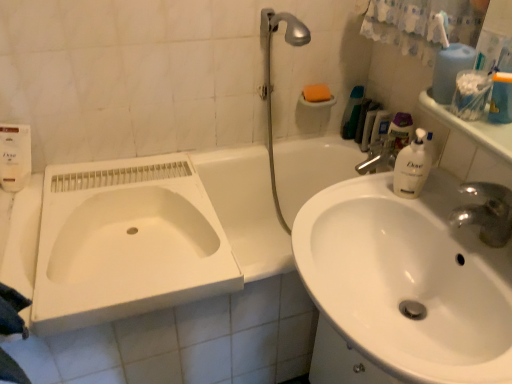
Question: Considering the relative positions of clear plastic container at upper right, which is the second mouthwash in back-to-front order, and silver metallic shower head at upper right in the image provided, is clear plastic container at upper right, which is the second mouthwash in back-to-front order, to the right of silver metallic shower head at upper right from the viewer's perspective?

Choices:
 (A) no
 (B) yes

Answer: (B)

Question: From a real-world perspective, is clear plastic container at upper right, the first mouthwash when ordered from left to right, positioned under silver metallic shower head at upper right based on gravity?

Choices:
 (A) no
 (B) yes

Answer: (A)

Question: Is clear plastic container at upper right, arranged as the 1th mouthwash when viewed from the front, touching silver metallic shower head at upper right?

Choices:
 (A) no
 (B) yes

Answer: (A)

Question: Is clear plastic container at upper right, the first mouthwash when ordered from left to right, wider than silver metallic shower head at upper right?

Choices:
 (A) no
 (B) yes

Answer: (A)

Question: Would you say silver metallic shower head at upper right is part of clear plastic container at upper right, the first mouthwash when ordered from left to right,'s contents?

Choices:
 (A) yes
 (B) no

Answer: (B)

Question: From a real-world perspective, is orange matte soap at upper center above or below silver metallic shower head at upper right?

Choices:
 (A) above
 (B) below

Answer: (A)

Question: From their relative heights in the image, would you say orange matte soap at upper center is taller or shorter than silver metallic shower head at upper right?

Choices:
 (A) tall
 (B) short

Answer: (B)

Question: Considering the positions of orange matte soap at upper center and silver metallic shower head at upper right in the image, is orange matte soap at upper center bigger or smaller than silver metallic shower head at upper right?

Choices:
 (A) small
 (B) big

Answer: (A)

Question: Visually, is orange matte soap at upper center positioned to the left or to the right of silver metallic shower head at upper right?

Choices:
 (A) left
 (B) right

Answer: (B)

Question: From a real-world perspective, is green matte toothpaste tube at upper right, the 2th toiletry from the right, above or below clear plastic bottle at upper right, the second mouthwash viewed from the left?

Choices:
 (A) below
 (B) above

Answer: (B)

Question: Is green matte toothpaste tube at upper right, which appears as the first toiletry when viewed from the left, bigger or smaller than clear plastic bottle at upper right, the 2th mouthwash viewed from the front?

Choices:
 (A) big
 (B) small

Answer: (B)

Question: Is green matte toothpaste tube at upper right, which appears as the first toiletry when viewed from the left, to the left or to the right of clear plastic bottle at upper right, the 2th mouthwash viewed from the front, in the image?

Choices:
 (A) left
 (B) right

Answer: (A)

Question: Do you think green matte toothpaste tube at upper right, the 2th toiletry from the right, is within clear plastic bottle at upper right, the second mouthwash viewed from the left, or outside of it?

Choices:
 (A) outside
 (B) inside

Answer: (A)

Question: Based on their sizes in the image, would you say white plastic container at upper right is bigger or smaller than green matte toothpaste tube at upper right, the 2th toiletry from the right?

Choices:
 (A) big
 (B) small

Answer: (A)

Question: Is white plastic container at upper right wider or thinner than green matte toothpaste tube at upper right, the 2th toiletry from the right?

Choices:
 (A) wide
 (B) thin

Answer: (A)